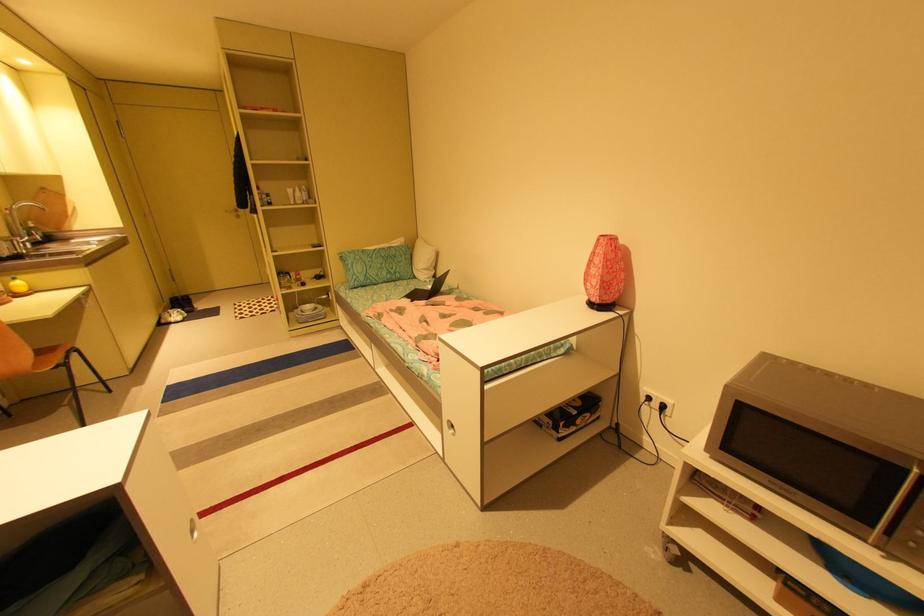
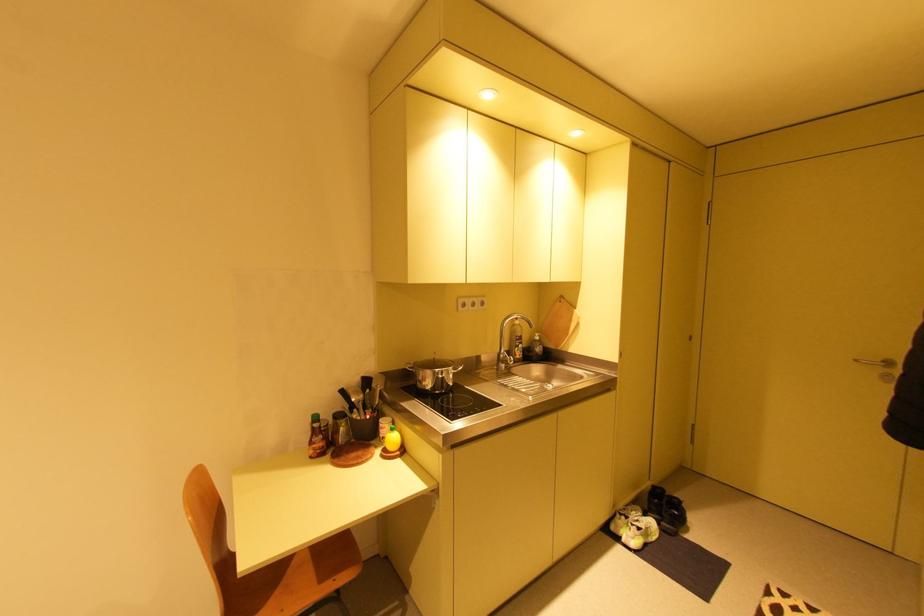
The point at (176, 299) is marked in the first image. Where is the corresponding point in the second image?

(660, 487)